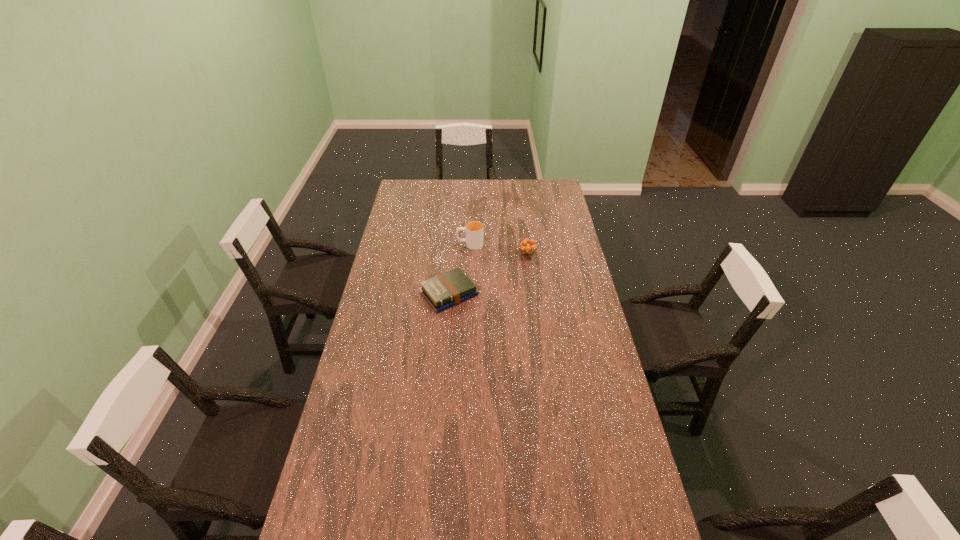
The height and width of the screenshot is (540, 960). Find the location of `empty location between the book and the rightmost object`. empty location between the book and the rightmost object is located at coordinates (488, 273).

You are a GUI agent. You are given a task and a screenshot of the screen. Output one action in this format:
    pyautogui.click(x=<x>, y=<y>)
    Task: Click on the object that stands as the second closest to the second tallest object
    The width and height of the screenshot is (960, 540).
    Given the screenshot: What is the action you would take?
    pyautogui.click(x=443, y=291)

You are a GUI agent. You are given a task and a screenshot of the screen. Output one action in this format:
    pyautogui.click(x=<x>, y=<y>)
    Task: Click on the object that is the closest to the tallest object
    This screenshot has height=540, width=960.
    Given the screenshot: What is the action you would take?
    pyautogui.click(x=527, y=246)